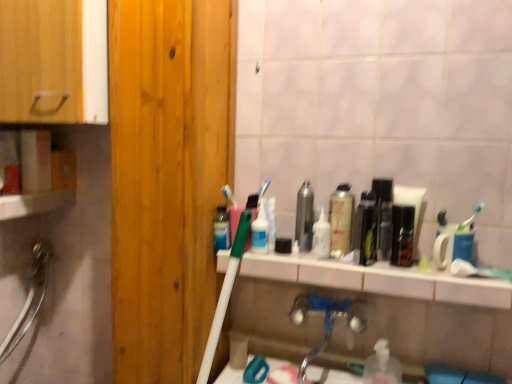
The width and height of the screenshot is (512, 384). In order to click on light brown wood door at left in this screenshot , I will do `click(167, 178)`.

Identify the location of white glossy toothpaste tube at center, positioned as the 2th toiletry in right-to-left order. Image resolution: width=512 pixels, height=384 pixels. (260, 231).

You are a GUI agent. You are given a task and a screenshot of the screen. Output one action in this format:
    pyautogui.click(x=<x>, y=<y>)
    Task: Click on the clear plastic bottle at lower center, positioned as the 5th mouthwash in left-to-right order
    
    Given the screenshot: What is the action you would take?
    pyautogui.click(x=382, y=366)

The image size is (512, 384). Find the location of `white glossy bottle at center, acting as the 2th toiletry starting from the left`. white glossy bottle at center, acting as the 2th toiletry starting from the left is located at coordinates (321, 237).

The image size is (512, 384). What are the coordinates of `wooden cabinet at left` in the screenshot? It's located at (53, 61).

What do you see at coordinates (221, 228) in the screenshot?
I see `blue glossy bottle at center, the 6th mouthwash positioned from the right` at bounding box center [221, 228].

The height and width of the screenshot is (384, 512). What are the coordinates of `light brown wood door at left` in the screenshot? It's located at (167, 178).

Considering the relative sizes of silver metallic faucet at lower center and white glossy bottle at center, placed as the first toiletry when sorted from right to left, in the image provided, is silver metallic faucet at lower center thinner than white glossy bottle at center, placed as the first toiletry when sorted from right to left,?

No, silver metallic faucet at lower center is not thinner than white glossy bottle at center, placed as the first toiletry when sorted from right to left.

From their relative heights in the image, would you say silver metallic faucet at lower center is taller or shorter than white glossy bottle at center, placed as the first toiletry when sorted from right to left?

Considering their sizes, silver metallic faucet at lower center has more height than white glossy bottle at center, placed as the first toiletry when sorted from right to left.

Based on the photo, is silver metallic faucet at lower center at the left side of white glossy bottle at center, placed as the first toiletry when sorted from right to left?

In fact, silver metallic faucet at lower center is to the right of white glossy bottle at center, placed as the first toiletry when sorted from right to left.

Are silver metallic faucet at lower center and white glossy bottle at center, acting as the 2th toiletry starting from the left, located far from each other?

That's not correct — silver metallic faucet at lower center is a little close to white glossy bottle at center, acting as the 2th toiletry starting from the left.

From a real-world perspective, does green plastic mouthwash at center, which appears as the fifth mouthwash when viewed from the right, stand above clear plastic bottle at lower center, positioned as the 5th mouthwash in left-to-right order?

Correct, in the physical world, green plastic mouthwash at center, which appears as the fifth mouthwash when viewed from the right, is higher than clear plastic bottle at lower center, positioned as the 5th mouthwash in left-to-right order.

Which of these two, green plastic mouthwash at center, the second mouthwash when ordered from left to right, or clear plastic bottle at lower center, the 2th mouthwash positioned from the right, is thinner?

green plastic mouthwash at center, the second mouthwash when ordered from left to right.

Measure the distance from green plastic mouthwash at center, the second mouthwash when ordered from left to right, to clear plastic bottle at lower center, the 2th mouthwash positioned from the right.

green plastic mouthwash at center, the second mouthwash when ordered from left to right, is 18.20 inches away from clear plastic bottle at lower center, the 2th mouthwash positioned from the right.

Considering the positions of objects green plastic mouthwash at center, which appears as the fifth mouthwash when viewed from the right, and clear plastic bottle at lower center, the 2th mouthwash positioned from the right, in the image provided, who is more to the left, green plastic mouthwash at center, which appears as the fifth mouthwash when viewed from the right, or clear plastic bottle at lower center, the 2th mouthwash positioned from the right,?

green plastic mouthwash at center, which appears as the fifth mouthwash when viewed from the right.

Is point (361, 318) farther from camera compared to point (56, 15)?

That is True.

Locate an element on the screen. tap lying on the right of wooden cabinet at left is located at coordinates (325, 321).

From the image's perspective, is silver metallic faucet at lower center beneath wooden cabinet at left?

Correct, silver metallic faucet at lower center appears lower than wooden cabinet at left in the image.

Which is nearer, [334,238] or [370,376]?

Clearly, point [334,238] is closer to the camera than point [370,376].

Is shiny metallic mouthwash at center, the third mouthwash in the right-to-left sequence, taller than clear plastic bottle at lower center, positioned as the 5th mouthwash in left-to-right order?

Correct, shiny metallic mouthwash at center, the third mouthwash in the right-to-left sequence, is much taller as clear plastic bottle at lower center, positioned as the 5th mouthwash in left-to-right order.

From the image's perspective, is shiny metallic mouthwash at center, the 4th mouthwash in the left-to-right sequence, located above clear plastic bottle at lower center, positioned as the 5th mouthwash in left-to-right order?

Yes, from the image's perspective, shiny metallic mouthwash at center, the 4th mouthwash in the left-to-right sequence, is above clear plastic bottle at lower center, positioned as the 5th mouthwash in left-to-right order.

Between shiny metallic mouthwash at center, the third mouthwash in the right-to-left sequence, and clear plastic bottle at lower center, positioned as the 5th mouthwash in left-to-right order, which one has larger size?

clear plastic bottle at lower center, positioned as the 5th mouthwash in left-to-right order, is bigger.

Which point is more distant from viewer, (84, 87) or (341, 219)?

The point (341, 219) is farther from the camera.

Could you tell me if wooden cabinet at left is facing shiny metallic mouthwash at center, the third mouthwash in the right-to-left sequence?

No, wooden cabinet at left is not aimed at shiny metallic mouthwash at center, the third mouthwash in the right-to-left sequence.

From the image's perspective, who appears lower, wooden cabinet at left or shiny metallic mouthwash at center, the third mouthwash in the right-to-left sequence?

From the image's view, shiny metallic mouthwash at center, the third mouthwash in the right-to-left sequence, is below.

Can you confirm if wooden cabinet at left is positioned to the right of shiny metallic mouthwash at center, the 4th mouthwash in the left-to-right sequence?

No.

Which of these two, silver metallic faucet at lower center or white glossy toothpaste tube at center, positioned as the 2th toiletry in right-to-left order, is bigger?

With larger size is silver metallic faucet at lower center.

Is point (311, 308) farther from camera compared to point (252, 236)?

Yes, point (311, 308) is farther from viewer.

Does silver metallic faucet at lower center contain white glossy toothpaste tube at center, positioned as the 2th toiletry in right-to-left order?

No.

From their relative heights in the image, would you say silver metallic faucet at lower center is taller or shorter than white glossy toothpaste tube at center, which ranks as the 1th toiletry in left-to-right order?

In the image, silver metallic faucet at lower center appears to be taller than white glossy toothpaste tube at center, which ranks as the 1th toiletry in left-to-right order.

Does green plastic mouthwash at center, the second mouthwash when ordered from left to right, contain black glossy mouthwash at center, which is counted as the first mouthwash, starting from the right?

No, black glossy mouthwash at center, which is counted as the first mouthwash, starting from the right, is not surrounded by green plastic mouthwash at center, the second mouthwash when ordered from left to right.

From the image's perspective, would you say green plastic mouthwash at center, the second mouthwash when ordered from left to right, is positioned over black glossy mouthwash at center, acting as the 6th mouthwash starting from the left?

Yes, from the image's perspective, green plastic mouthwash at center, the second mouthwash when ordered from left to right, is on top of black glossy mouthwash at center, acting as the 6th mouthwash starting from the left.

Is point (251, 203) farther from camera compared to point (375, 246)?

Yes, point (251, 203) is farther from viewer.

This screenshot has height=384, width=512. I want to click on tap that appears below the white glossy bottle at center, acting as the 2th toiletry starting from the left (from the image's perspective), so click(x=325, y=321).

Image resolution: width=512 pixels, height=384 pixels. In order to click on mouthwash that is the 3rd one above the clear plastic bottle at lower center, the 2th mouthwash positioned from the right (from a real-world perspective) in this screenshot , I will do `click(253, 204)`.

In the scene shown: Looking at the image, which one is located further to white glossy counter top at center, black glossy mouthwash at center, which is counted as the first mouthwash, starting from the right, or shiny metallic mouthwash at center, the third mouthwash in the right-to-left sequence?

black glossy mouthwash at center, which is counted as the first mouthwash, starting from the right.

In the scene shown: When comparing their distances from white glossy counter top at center, does white glossy toothpaste tube at center, positioned as the 2th toiletry in right-to-left order, or metallic can at center, which appears as the third mouthwash when viewed from the left, seem further?

Among the two, white glossy toothpaste tube at center, positioned as the 2th toiletry in right-to-left order, is located further to white glossy counter top at center.

Looking at the image, which one is located closer to silver metallic faucet at lower center, shiny metallic mouthwash at center, the third mouthwash in the right-to-left sequence, or green plastic mouthwash at center, which appears as the fifth mouthwash when viewed from the right?

Based on the image, shiny metallic mouthwash at center, the third mouthwash in the right-to-left sequence, appears to be nearer to silver metallic faucet at lower center.

Considering their positions, is clear plastic bottle at lower center, the 2th mouthwash positioned from the right, positioned closer to shiny metallic mouthwash at center, the third mouthwash in the right-to-left sequence, than green plastic mouthwash at center, the second mouthwash when ordered from left to right?

green plastic mouthwash at center, the second mouthwash when ordered from left to right, is closer to shiny metallic mouthwash at center, the third mouthwash in the right-to-left sequence.

Based on their spatial positions, is silver metallic faucet at lower center or clear plastic bottle at lower center, positioned as the 5th mouthwash in left-to-right order, further from metallic can at center, acting as the 4th mouthwash starting from the right?

clear plastic bottle at lower center, positioned as the 5th mouthwash in left-to-right order, is further to metallic can at center, acting as the 4th mouthwash starting from the right.

Estimate the real-world distances between objects in this image. Which object is further from wooden cabinet at left, white glossy bottle at center, acting as the 2th toiletry starting from the left, or light brown wood door at left?

The object further to wooden cabinet at left is white glossy bottle at center, acting as the 2th toiletry starting from the left.

From the image, which object appears to be nearer to blue glossy bottle at center, the 6th mouthwash positioned from the right, metallic can at center, which appears as the third mouthwash when viewed from the left, or white glossy toothpaste tube at center, which ranks as the 1th toiletry in left-to-right order?

The object closer to blue glossy bottle at center, the 6th mouthwash positioned from the right, is white glossy toothpaste tube at center, which ranks as the 1th toiletry in left-to-right order.

Based on their spatial positions, is green plastic mouthwash at center, the second mouthwash when ordered from left to right, or silver metallic faucet at lower center further from white glossy toothpaste tube at center, positioned as the 2th toiletry in right-to-left order?

Among the two, silver metallic faucet at lower center is located further to white glossy toothpaste tube at center, positioned as the 2th toiletry in right-to-left order.

In order to click on toiletry located between green plastic mouthwash at center, which appears as the fifth mouthwash when viewed from the right, and metallic can at center, acting as the 4th mouthwash starting from the right, in the left-right direction in this screenshot , I will do `click(260, 231)`.

The width and height of the screenshot is (512, 384). I want to click on door located between wooden cabinet at left and metallic can at center, acting as the 4th mouthwash starting from the right, in the left-right direction, so click(x=167, y=178).

Image resolution: width=512 pixels, height=384 pixels. I want to click on toiletry between white glossy toothpaste tube at center, which ranks as the 1th toiletry in left-to-right order, and white glossy counter top at center from left to right, so click(321, 237).

Find the location of a particular element. mouthwash between white glossy toothpaste tube at center, which ranks as the 1th toiletry in left-to-right order, and shiny metallic mouthwash at center, the 4th mouthwash in the left-to-right sequence, in the horizontal direction is located at coordinates (304, 217).